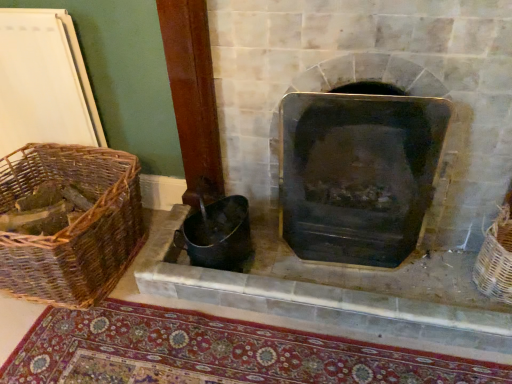
Question: Are woven wicker basket at right, arranged as the 1th basket when viewed from the right, and carpeted mat at lower center located far from each other?

Choices:
 (A) no
 (B) yes

Answer: (A)

Question: From the image's perspective, is woven wicker basket at right, the 2th basket positioned from the left, beneath carpeted mat at lower center?

Choices:
 (A) no
 (B) yes

Answer: (A)

Question: Can you confirm if woven wicker basket at right, arranged as the 1th basket when viewed from the right, is positioned to the left of carpeted mat at lower center?

Choices:
 (A) yes
 (B) no

Answer: (B)

Question: Considering the relative positions of woven wicker basket at right, the 2th basket positioned from the left, and carpeted mat at lower center in the image provided, is woven wicker basket at right, the 2th basket positioned from the left, behind carpeted mat at lower center?

Choices:
 (A) no
 (B) yes

Answer: (B)

Question: Considering the relative sizes of woven wicker basket at right, the 2th basket positioned from the left, and carpeted mat at lower center in the image provided, is woven wicker basket at right, the 2th basket positioned from the left, smaller than carpeted mat at lower center?

Choices:
 (A) yes
 (B) no

Answer: (A)

Question: From the image's perspective, is woven wicker basket at right, arranged as the 1th basket when viewed from the right, on top of carpeted mat at lower center?

Choices:
 (A) yes
 (B) no

Answer: (A)

Question: Is woven wicker basket at right, the 2th basket positioned from the left, thinner than woven brown basket at left, the second basket positioned from the right?

Choices:
 (A) yes
 (B) no

Answer: (A)

Question: Is woven wicker basket at right, the 2th basket positioned from the left, placed right next to woven brown basket at left, the second basket positioned from the right?

Choices:
 (A) no
 (B) yes

Answer: (A)

Question: Is woven wicker basket at right, the 2th basket positioned from the left, positioned far away from woven brown basket at left, placed as the first basket when sorted from left to right?

Choices:
 (A) no
 (B) yes

Answer: (B)

Question: Does woven wicker basket at right, the 2th basket positioned from the left, have a larger size compared to woven brown basket at left, placed as the first basket when sorted from left to right?

Choices:
 (A) yes
 (B) no

Answer: (B)

Question: Does woven wicker basket at right, arranged as the 1th basket when viewed from the right, appear on the right side of woven brown basket at left, the second basket positioned from the right?

Choices:
 (A) yes
 (B) no

Answer: (A)

Question: From a real-world perspective, is woven wicker basket at right, the 2th basket positioned from the left, located higher than woven brown basket at left, the second basket positioned from the right?

Choices:
 (A) no
 (B) yes

Answer: (A)

Question: Is woven brown basket at left, placed as the first basket when sorted from left to right, shorter than woven wicker basket at right, arranged as the 1th basket when viewed from the right?

Choices:
 (A) yes
 (B) no

Answer: (B)